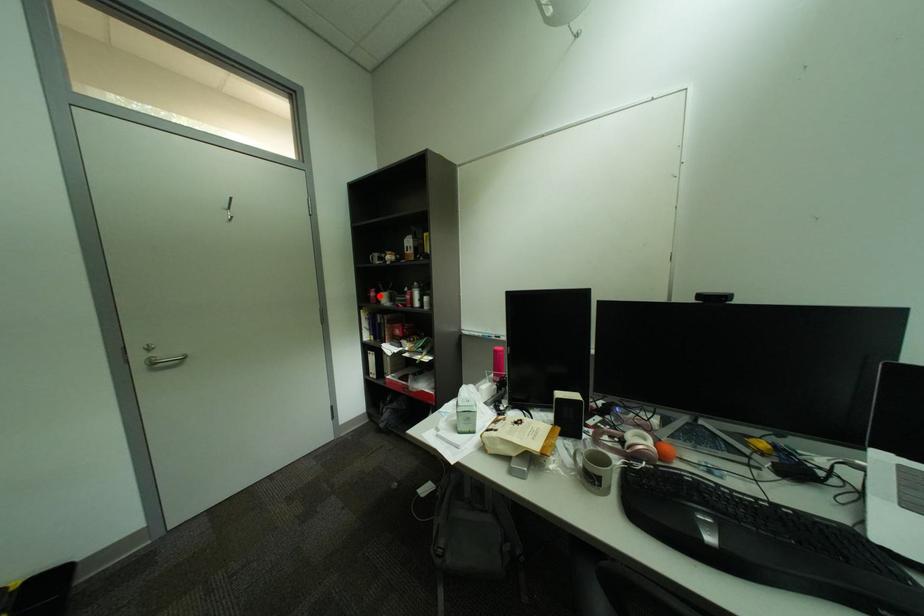
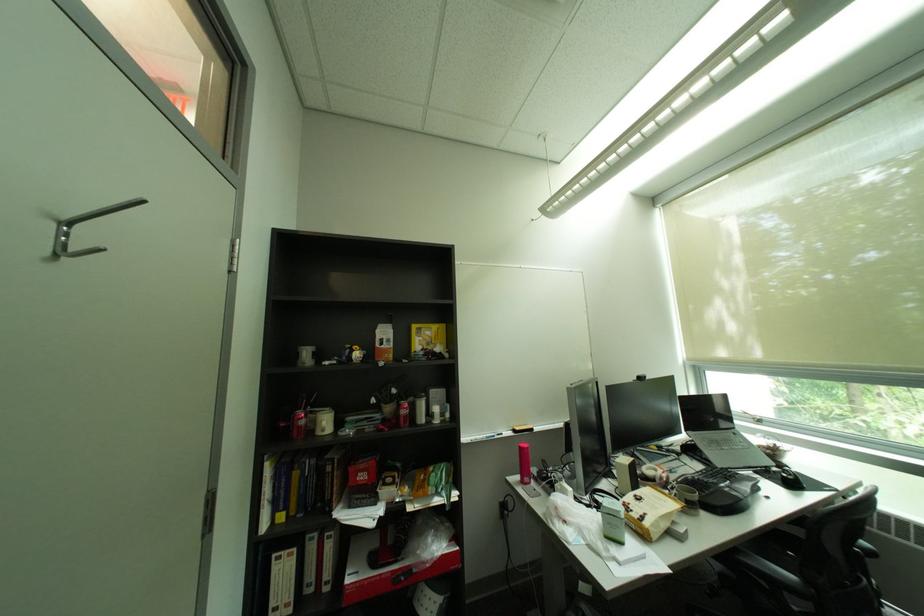
Find the pixel in the second image that matches the highlighted location in the first image.

(293, 426)